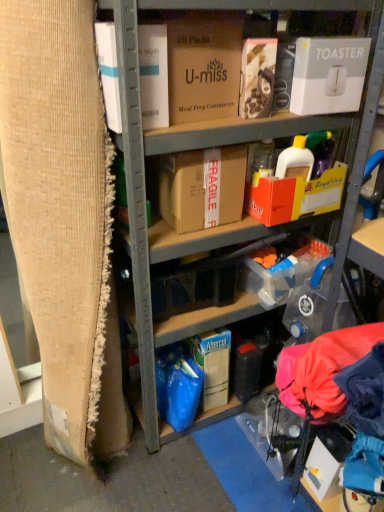
Question: Based on their positions, is cardboard boxes at center located to the left or right of brown cardboard box at center, arranged as the 2th box when viewed from the right?

Choices:
 (A) left
 (B) right

Answer: (B)

Question: In terms of size, does cardboard boxes at center appear bigger or smaller than brown cardboard box at center, arranged as the 2th box when viewed from the right?

Choices:
 (A) big
 (B) small

Answer: (A)

Question: Which of these objects is positioned closest to the white cardboard box at upper left, which is the 4th box from right to left?

Choices:
 (A) brown cardboard at left
 (B) brown cardboard box at center, arranged as the 2th box when viewed from the right
 (C) white cardboard toaster at upper right, acting as the first box starting from the right
 (D) blue plastic storage box at lower center
 (E) cardboard boxes at center

Answer: (E)

Question: Based on their relative distances, which object is nearer to the white cardboard toaster at upper right, acting as the first box starting from the right?

Choices:
 (A) brown cardboard box at center, which appears as the 3th box when viewed from the left
 (B) brown cardboard box at upper center, which ranks as the 3th box in right-to-left order
 (C) white cardboard box at upper left, which is the 4th box from right to left
 (D) brown cardboard at left
 (E) cardboard boxes at center

Answer: (E)